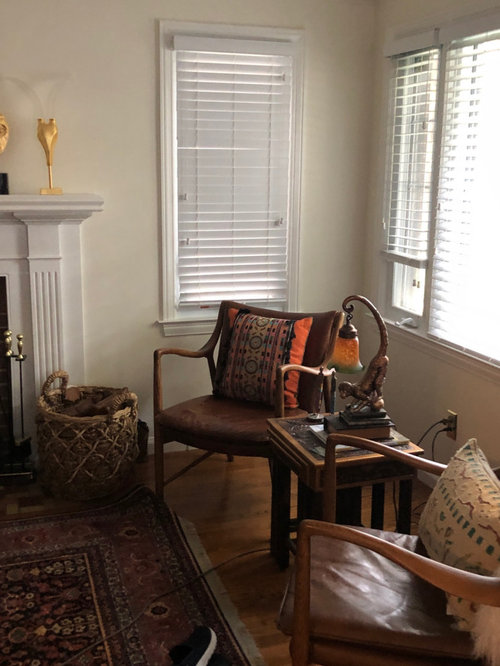
I want to click on plug cords, so click(437, 420), click(447, 428), click(220, 563).